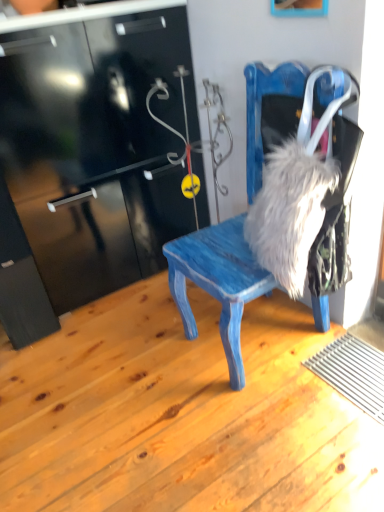
What do you see at coordinates (299, 8) in the screenshot? I see `wooden picture frame at upper center` at bounding box center [299, 8].

What do you see at coordinates (218, 282) in the screenshot? I see `blue painted wood chair at center` at bounding box center [218, 282].

The image size is (384, 512). In order to click on wooden picture frame at upper center in this screenshot , I will do `click(299, 8)`.

Is the position of blue painted wood chair at center more distant than that of fuzzy gray fur at right?

No, blue painted wood chair at center is in front of fuzzy gray fur at right.

Is blue painted wood chair at center outside of fuzzy gray fur at right?

That's correct, blue painted wood chair at center is outside of fuzzy gray fur at right.

Considering the relative sizes of blue painted wood chair at center and fuzzy gray fur at right in the image provided, is blue painted wood chair at center wider than fuzzy gray fur at right?

Correct, the width of blue painted wood chair at center exceeds that of fuzzy gray fur at right.

Is point (281, 3) closer to viewer compared to point (288, 170)?

No, (281, 3) is further to viewer.

Find the location of a particular element. Image resolution: width=384 pixels, height=512 pixels. animal that appears below the wooden picture frame at upper center (from a real-world perspective) is located at coordinates (290, 211).

Considering the positions of objects wooden picture frame at upper center and fuzzy gray fur at right in the image provided, who is behind, wooden picture frame at upper center or fuzzy gray fur at right?

fuzzy gray fur at right is further away from the camera.

Looking at this image, from a real-world perspective, which is physically below, wooden picture frame at upper center or fuzzy gray fur at right?

fuzzy gray fur at right is physically lower.

Consider the image. Is blue painted wood chair at center shorter than wooden picture frame at upper center?

In fact, blue painted wood chair at center may be taller than wooden picture frame at upper center.

Considering the sizes of blue painted wood chair at center and wooden picture frame at upper center in the image, is blue painted wood chair at center wider or thinner than wooden picture frame at upper center?

In the image, blue painted wood chair at center appears to be wider than wooden picture frame at upper center.

Is blue painted wood chair at center at the left side of wooden picture frame at upper center?

Indeed, blue painted wood chair at center is positioned on the left side of wooden picture frame at upper center.

From the image's perspective, relative to wooden picture frame at upper center, is blue painted wood chair at center above or below?

Clearly, from the image's perspective, blue painted wood chair at center is below wooden picture frame at upper center.

Could you tell me if fuzzy gray fur at right is turned towards blue painted wood chair at center?

Yes, fuzzy gray fur at right is turned towards blue painted wood chair at center.

Which of these two, fuzzy gray fur at right or blue painted wood chair at center, is wider?

blue painted wood chair at center is wider.

Is wooden picture frame at upper center inside or outside of blue painted wood chair at center?

wooden picture frame at upper center is not inside blue painted wood chair at center, it's outside.

Considering the sizes of wooden picture frame at upper center and blue painted wood chair at center in the image, is wooden picture frame at upper center taller or shorter than blue painted wood chair at center?

Considering their sizes, wooden picture frame at upper center has less height than blue painted wood chair at center.

From a real-world perspective, who is located higher, wooden picture frame at upper center or blue painted wood chair at center?

wooden picture frame at upper center.

Would you say wooden picture frame at upper center is a long distance from blue painted wood chair at center?

wooden picture frame at upper center is near blue painted wood chair at center, not far away.

Which object is positioned more to the right, fuzzy gray fur at right or wooden picture frame at upper center?

From the viewer's perspective, fuzzy gray fur at right appears more on the right side.

Is wooden picture frame at upper center at the back of fuzzy gray fur at right?

No, fuzzy gray fur at right is not facing the opposite direction of wooden picture frame at upper center.

Would you say fuzzy gray fur at right contains wooden picture frame at upper center?

That's incorrect, wooden picture frame at upper center is not inside fuzzy gray fur at right.

Where is `picture frame above the fuzzy gray fur at right (from a real-world perspective)`? This screenshot has width=384, height=512. picture frame above the fuzzy gray fur at right (from a real-world perspective) is located at coordinates coord(299,8).

You are a GUI agent. You are given a task and a screenshot of the screen. Output one action in this format:
    pyautogui.click(x=<x>, y=<y>)
    Task: Click on the animal below the blue painted wood chair at center (from a real-world perspective)
    The image size is (384, 512).
    Given the screenshot: What is the action you would take?
    pyautogui.click(x=290, y=211)

Locate an element on the screen. This screenshot has height=512, width=384. picture frame located in front of the fuzzy gray fur at right is located at coordinates (299, 8).

Estimate the real-world distances between objects in this image. Which object is closer to fuzzy gray fur at right, blue painted wood chair at center or wooden picture frame at upper center?

blue painted wood chair at center lies closer to fuzzy gray fur at right than the other object.

Which object lies nearer to the anchor point wooden picture frame at upper center, blue painted wood chair at center or fuzzy gray fur at right?

Among the two, blue painted wood chair at center is located nearer to wooden picture frame at upper center.

Based on their spatial positions, is wooden picture frame at upper center or fuzzy gray fur at right further from blue painted wood chair at center?

wooden picture frame at upper center.

Estimate the real-world distances between objects in this image. Which object is further from fuzzy gray fur at right, wooden picture frame at upper center or blue painted wood chair at center?

wooden picture frame at upper center.

Estimate the real-world distances between objects in this image. Which object is further from wooden picture frame at upper center, fuzzy gray fur at right or blue painted wood chair at center?

Based on the image, fuzzy gray fur at right appears to be further to wooden picture frame at upper center.

Looking at the image, which one is located closer to blue painted wood chair at center, fuzzy gray fur at right or wooden picture frame at upper center?

The object closer to blue painted wood chair at center is fuzzy gray fur at right.

I want to click on chair between wooden picture frame at upper center and fuzzy gray fur at right in the up-down direction, so click(x=218, y=282).